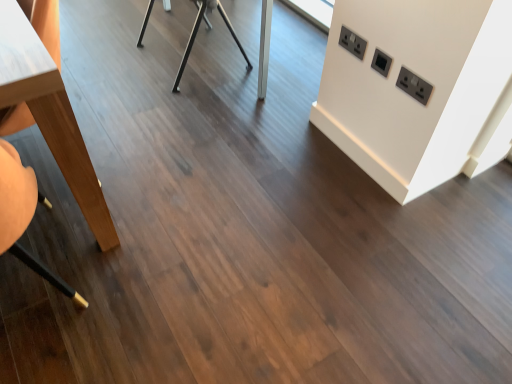
You are a GUI agent. You are given a task and a screenshot of the screen. Output one action in this format:
    pyautogui.click(x=<x>, y=<y>)
    Task: Click on the vacant space that's between metallic silver table at center, the 2th table positioned from the front, and light brown wood table at left, the 2th table viewed from the back
    
    Given the screenshot: What is the action you would take?
    pyautogui.click(x=147, y=99)